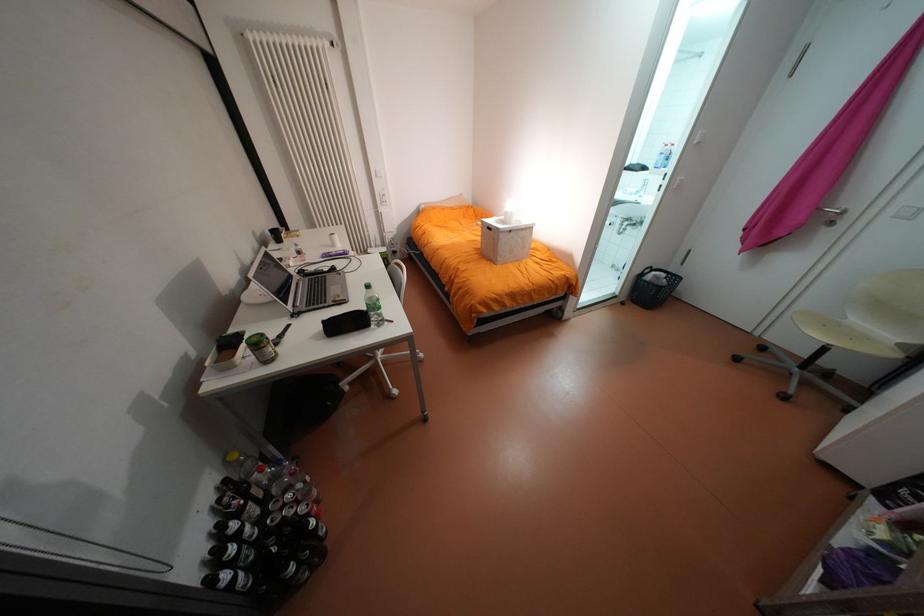
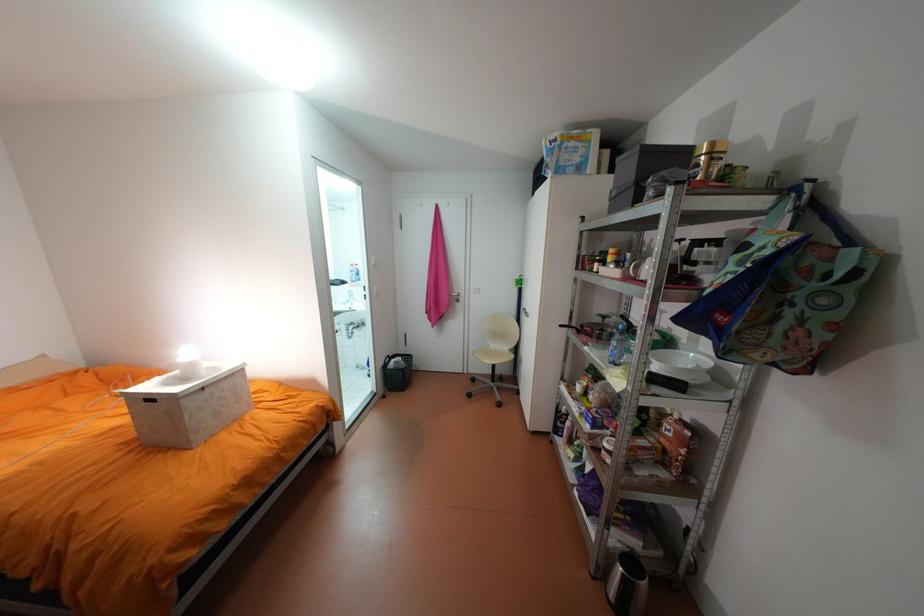
Question: The first image is from the beginning of the video and the second image is from the end. How did the camera likely rotate when shooting the video?

Choices:
 (A) Left
 (B) Right
 (C) Up
 (D) Down

Answer: (B)